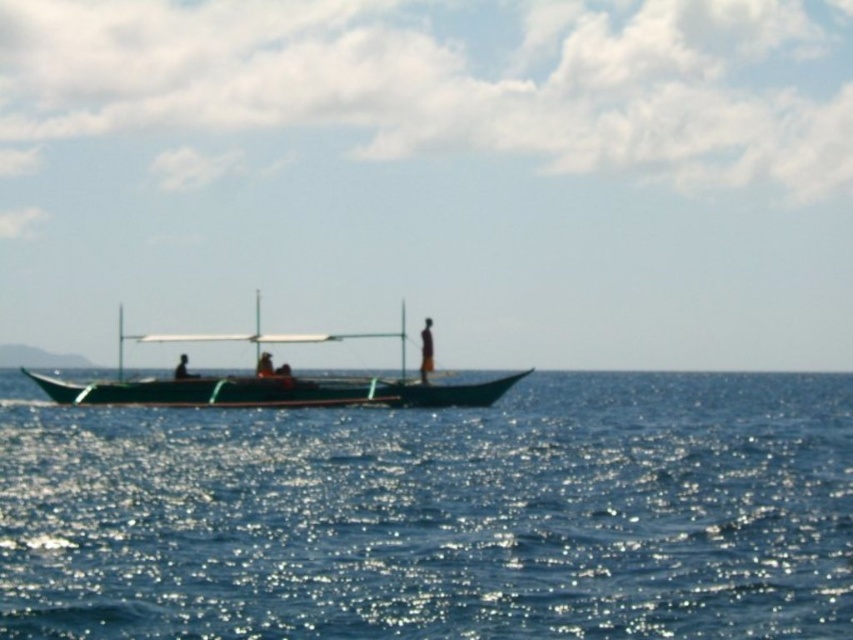
Question: Which point appears farthest from the camera in this image?

Choices:
 (A) (425, 362)
 (B) (263, 371)
 (C) (181, 369)
 (D) (154, 401)

Answer: (C)

Question: Which object is farther from the camera taking this photo?

Choices:
 (A) green matte boat at center
 (B) dark brown wooden boat at center

Answer: (B)

Question: Considering the relative positions of green matte boat at center and dark brown wooden boat at center in the image provided, where is green matte boat at center located with respect to dark brown wooden boat at center?

Choices:
 (A) right
 (B) left

Answer: (B)

Question: Is green matte boat at center further to the viewer compared to dark brown wooden person at center?

Choices:
 (A) no
 (B) yes

Answer: (A)

Question: From the image, what is the correct spatial relationship of blue water at center in relation to green matte boat at center?

Choices:
 (A) below
 (B) above

Answer: (A)

Question: Based on their relative distances, which object is farther from the dark brown wooden boat at center?

Choices:
 (A) green matte boat at center
 (B) dark brown wooden person at center
 (C) blue water at center

Answer: (C)